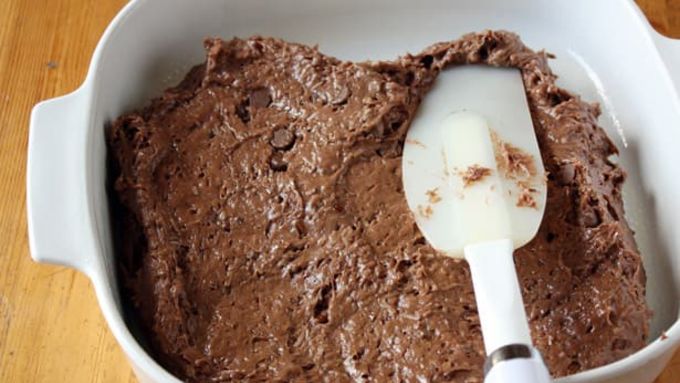
This screenshot has width=680, height=383. Identify the location of left handle. (52, 151).